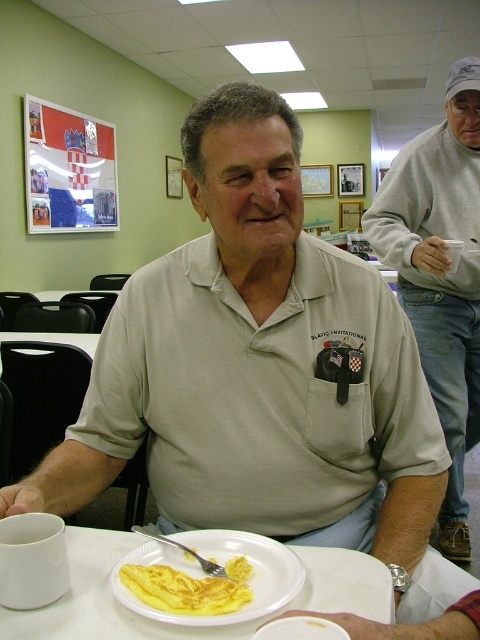
Does white matte plate at lower center have a greater height compared to yellow soft omelette at lower center?

Yes, white matte plate at lower center is taller than yellow soft omelette at lower center.

Between point (254, 600) and point (157, 566), which one is positioned in front?

Positioned in front is point (254, 600).

Locate an element on the screen. This screenshot has width=480, height=640. white matte plate at lower center is located at coordinates (219, 563).

Can you confirm if white paper plate at lower center is positioned to the right of silver metallic fork at plate center?

Indeed, white paper plate at lower center is positioned on the right side of silver metallic fork at plate center.

Can you confirm if white paper plate at lower center is positioned above silver metallic fork at plate center?

No.

What do you see at coordinates (184, 625) in the screenshot?
I see `white paper plate at lower center` at bounding box center [184, 625].

You are a GUI agent. You are given a task and a screenshot of the screen. Output one action in this format:
    pyautogui.click(x=<x>, y=<y>)
    Task: Click on the white paper plate at lower center
    This screenshot has width=480, height=640.
    Given the screenshot: What is the action you would take?
    pyautogui.click(x=184, y=625)

Is white matte plate at lower center smaller than silver metallic fork at plate center?

No.

Which is more to the left, white matte plate at lower center or silver metallic fork at plate center?

silver metallic fork at plate center is more to the left.

What do you see at coordinates (219, 563) in the screenshot? I see `white matte plate at lower center` at bounding box center [219, 563].

At what (x,y) coordinates should I click in order to perform the action: click on white matte plate at lower center. Please return your answer as a coordinate pair (x, y). The height and width of the screenshot is (640, 480). Looking at the image, I should click on (219, 563).